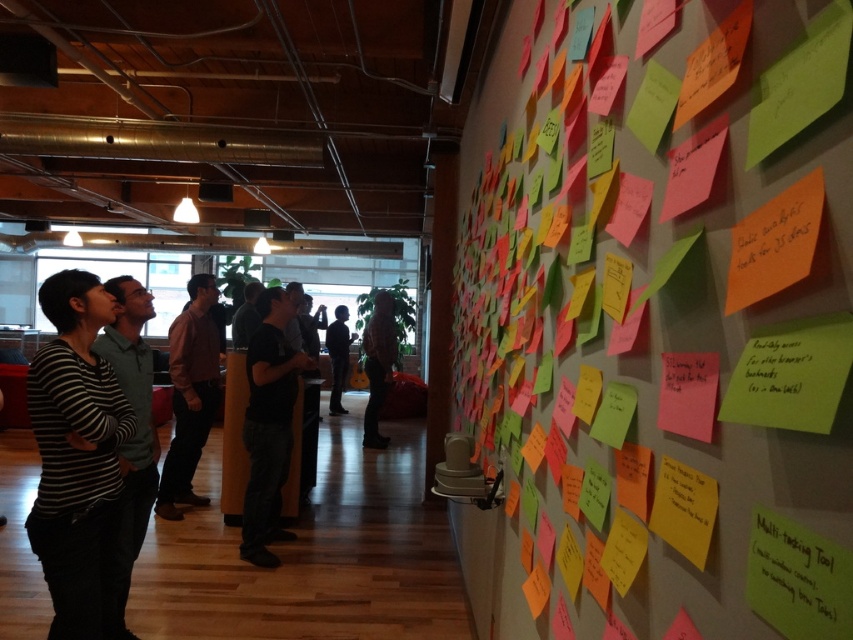
Question: Which object appears farthest from the camera in this image?

Choices:
 (A) colorful sticky notes at upper right
 (B) white matte sticky note at center
 (C) matte orange sticky note at upper right
 (D) matte black sticky notes at upper right

Answer: (B)

Question: Can you confirm if striped cotton shirt at left is positioned to the left of white matte sticky note at center?

Choices:
 (A) yes
 (B) no

Answer: (A)

Question: Which point is closer to the camera taking this photo?

Choices:
 (A) (166, 461)
 (B) (798, 204)
 (C) (666, 387)
 (D) (271, 305)

Answer: (B)

Question: Can you confirm if colorful sticky notes at upper right is wider than striped cotton shirt at left?

Choices:
 (A) yes
 (B) no

Answer: (B)

Question: Which object is the closest to the matte black sticky notes at upper right?

Choices:
 (A) pink shirt at center
 (B) silhouette clothing at center
 (C) white matte sticky note at center
 (D) striped cotton shirt at left

Answer: (C)

Question: Can you confirm if pink shirt at center is positioned below matte black sticky notes at upper right?

Choices:
 (A) no
 (B) yes

Answer: (B)